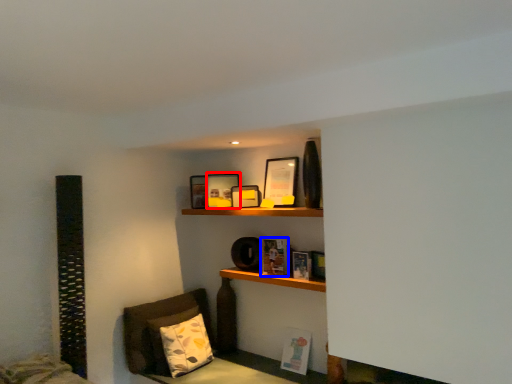
Question: Which object is closer to the camera taking this photo, picture frame (highlighted by a red box) or book (highlighted by a blue box)?

Choices:
 (A) picture frame
 (B) book

Answer: (B)